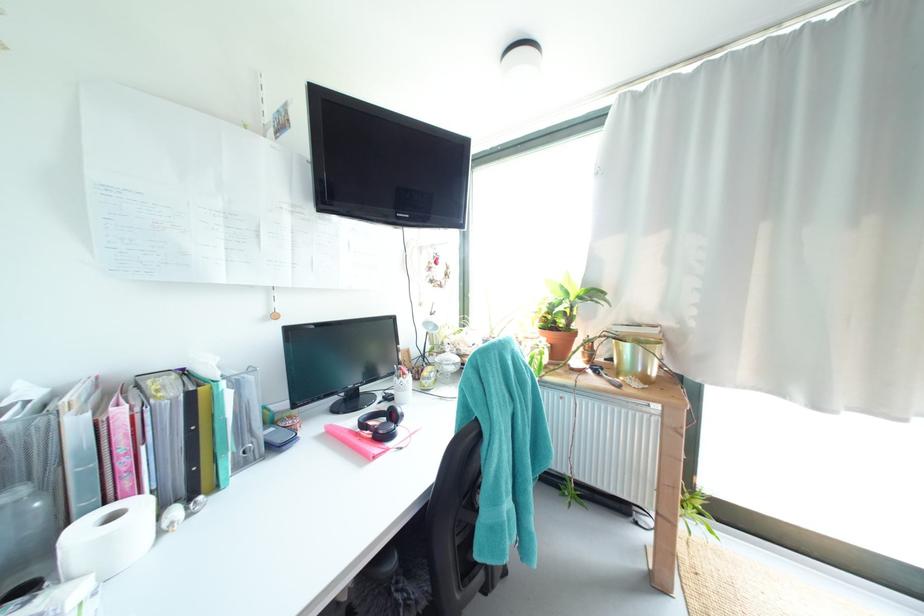
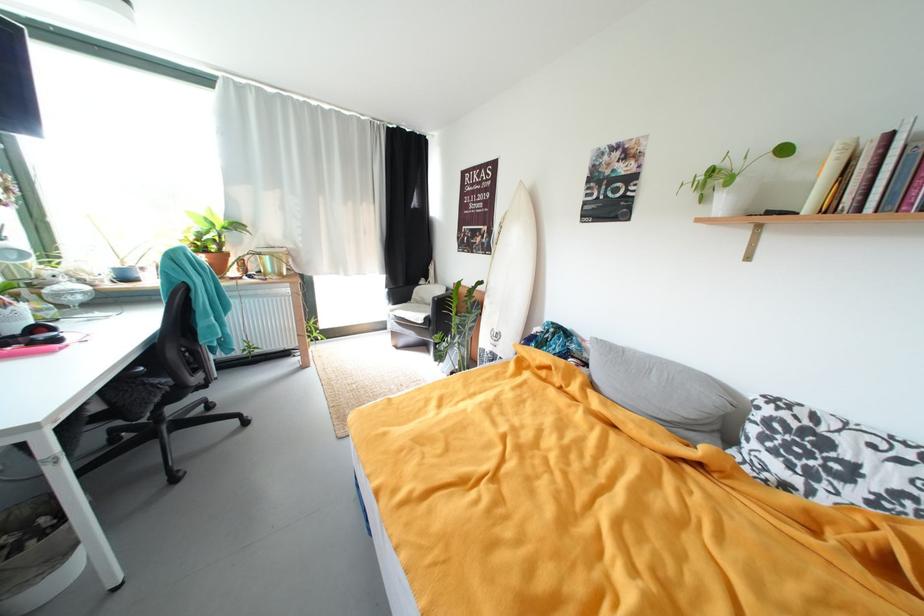
Locate, in the second image, the point that corresponds to pixel 495 339 in the first image.

(127, 268)